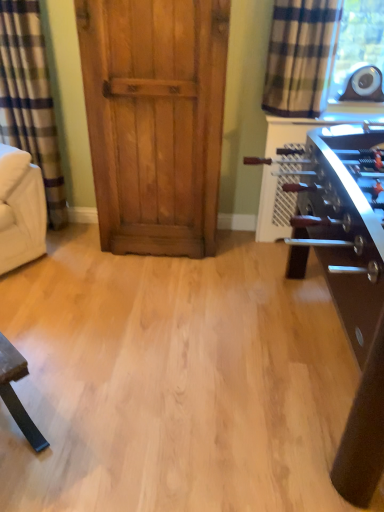
Question: Does plaid fabric curtain at upper right, positioned as the first curtain in right-to-left order, appear on the left side of wooden door at center?

Choices:
 (A) yes
 (B) no

Answer: (B)

Question: Does plaid fabric curtain at upper right, marked as the second curtain in a left-to-right arrangement, have a lesser height compared to wooden door at center?

Choices:
 (A) no
 (B) yes

Answer: (B)

Question: Considering the relative sizes of plaid fabric curtain at upper right, positioned as the first curtain in right-to-left order, and wooden door at center in the image provided, is plaid fabric curtain at upper right, positioned as the first curtain in right-to-left order, thinner than wooden door at center?

Choices:
 (A) yes
 (B) no

Answer: (A)

Question: From the image's perspective, does plaid fabric curtain at upper right, positioned as the first curtain in right-to-left order, appear higher than wooden door at center?

Choices:
 (A) yes
 (B) no

Answer: (A)

Question: Is plaid fabric curtain at upper right, positioned as the first curtain in right-to-left order, outside of wooden door at center?

Choices:
 (A) no
 (B) yes

Answer: (B)

Question: Is there a large distance between plaid fabric curtain at upper right, marked as the second curtain in a left-to-right arrangement, and wooden door at center?

Choices:
 (A) no
 (B) yes

Answer: (A)

Question: Could you tell me if plaid fabric curtain at upper right, positioned as the first curtain in right-to-left order, is facing shiny brown table at right?

Choices:
 (A) yes
 (B) no

Answer: (A)

Question: Is plaid fabric curtain at upper right, positioned as the first curtain in right-to-left order, positioned far away from shiny brown table at right?

Choices:
 (A) no
 (B) yes

Answer: (A)

Question: Is plaid fabric curtain at upper right, positioned as the first curtain in right-to-left order, shorter than shiny brown table at right?

Choices:
 (A) no
 (B) yes

Answer: (B)

Question: Is shiny brown table at right inside plaid fabric curtain at upper right, positioned as the first curtain in right-to-left order?

Choices:
 (A) yes
 (B) no

Answer: (B)

Question: Is plaid fabric curtain at upper right, marked as the second curtain in a left-to-right arrangement, not within shiny brown table at right?

Choices:
 (A) no
 (B) yes

Answer: (B)

Question: Does plaid fabric curtain at upper right, marked as the second curtain in a left-to-right arrangement, have a greater height compared to shiny brown table at right?

Choices:
 (A) no
 (B) yes

Answer: (A)

Question: Would you say shiny brown table at right contains plaid fabric curtain at upper right, marked as the second curtain in a left-to-right arrangement?

Choices:
 (A) no
 (B) yes

Answer: (A)